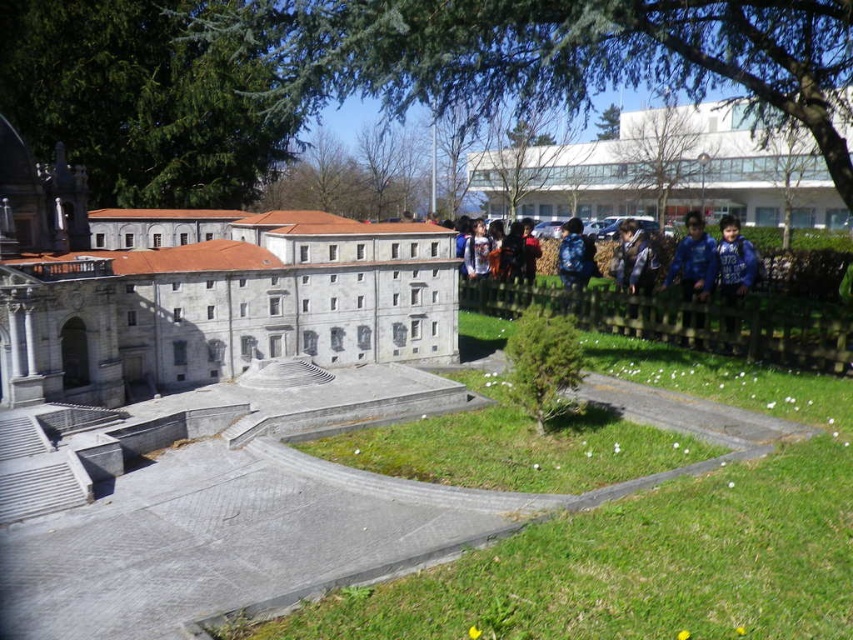
Question: Which point appears farthest from the camera in this image?

Choices:
 (A) (556, 266)
 (B) (634, 257)
 (C) (758, 182)

Answer: (C)

Question: Which of the following is the closest to the observer?

Choices:
 (A) (581, 278)
 (B) (653, 147)
 (C) (120, 380)
 (D) (625, 241)

Answer: (C)

Question: Is white glass building at center thinner than blue fabric shirt at right?

Choices:
 (A) no
 (B) yes

Answer: (A)

Question: Is gray stone building at center further to the viewer compared to blue backpack at center?

Choices:
 (A) no
 (B) yes

Answer: (A)

Question: Which of the following is the farthest from the observer?

Choices:
 (A) blue fabric shirt at right
 (B) blue backpack at center

Answer: (B)

Question: Observing the image, what is the correct spatial positioning of gray stone building at center in reference to blue backpack at center?

Choices:
 (A) below
 (B) above

Answer: (A)